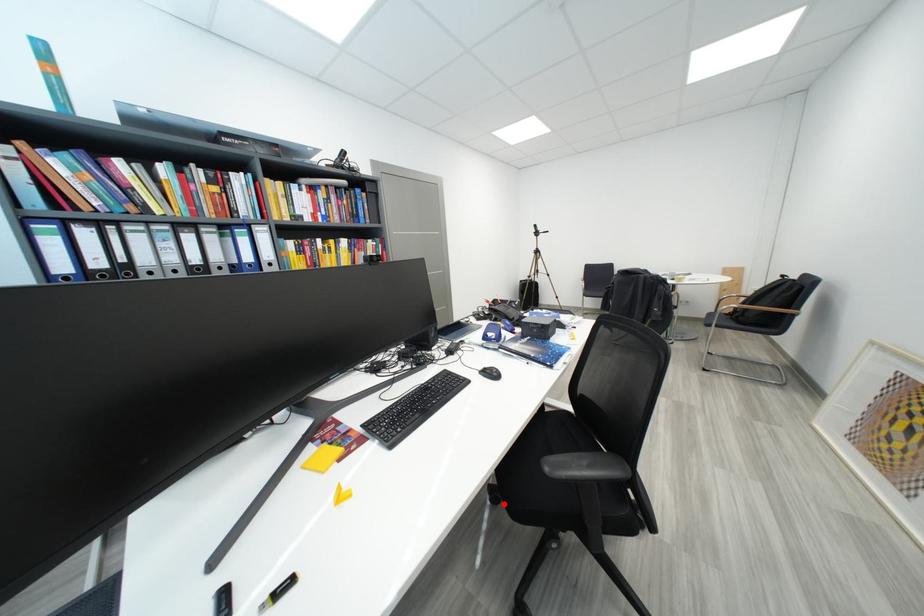
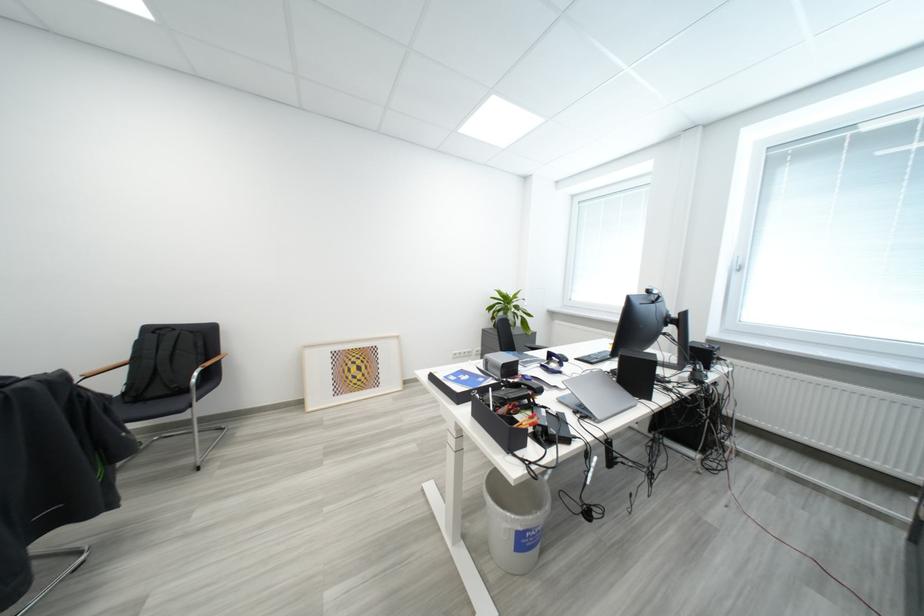
Question: I am providing you with two images of the same scene from different viewpoints. A red point is marked on the first image. At the location where the point appears in image 1, is it still visible in image 2?

Choices:
 (A) Yes
 (B) No

Answer: (B)